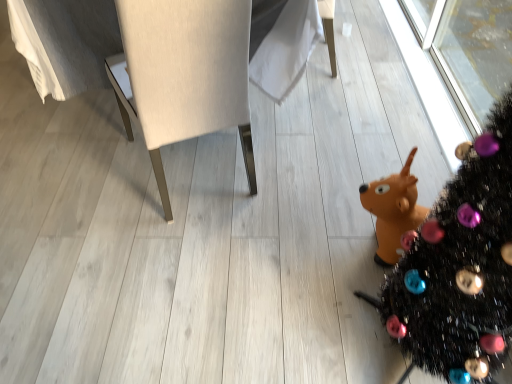
You are a GUI agent. You are given a task and a screenshot of the screen. Output one action in this format:
    pyautogui.click(x=<x>, y=<y>)
    Task: Click on the vacant space that is in between matte white chair at center and black glittery christmas tree at lower right
    
    Given the screenshot: What is the action you would take?
    pyautogui.click(x=288, y=263)